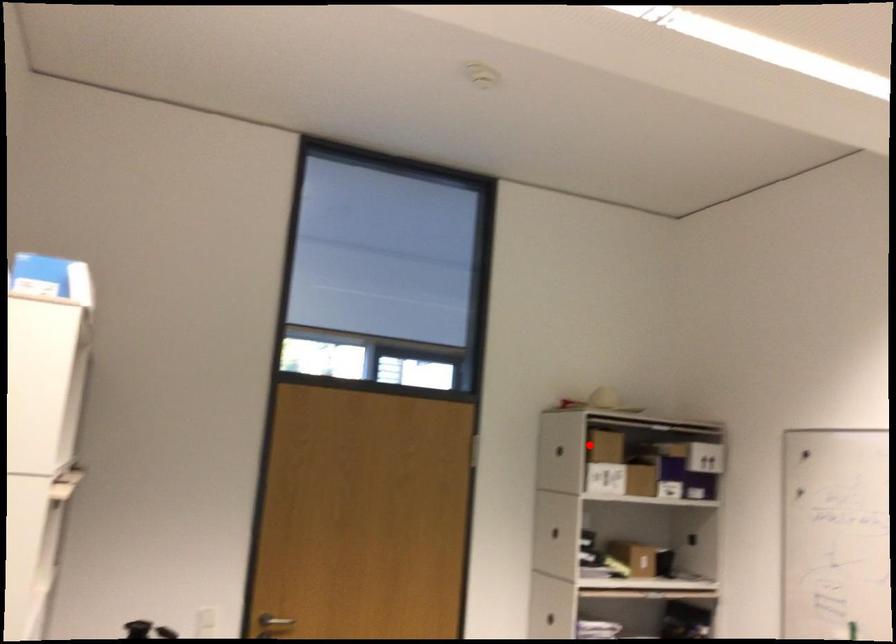
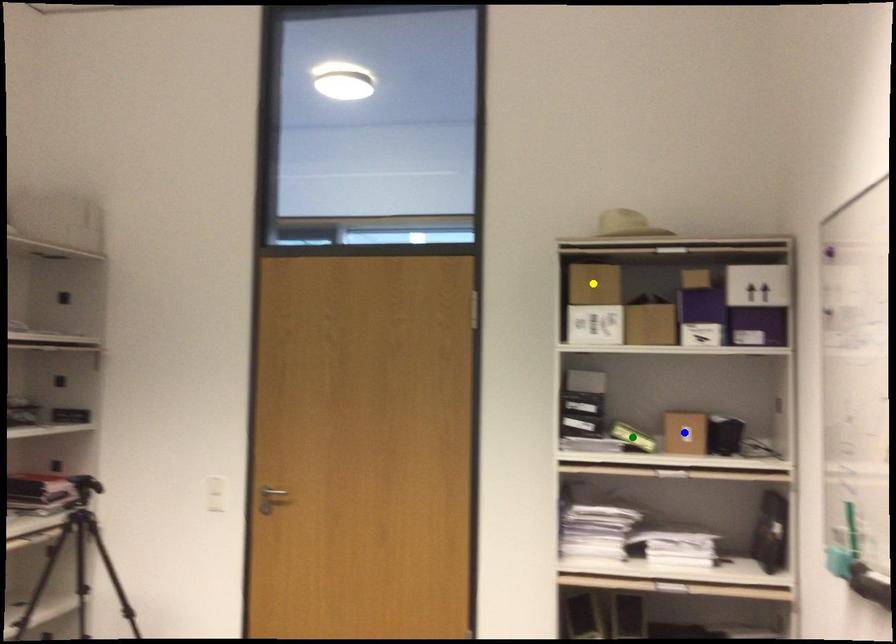
Question: I am providing you with two images of the same scene from different viewpoints. A red point is marked on the first image. You are given multiple points on the second image. In image 2, which mark is for the same physical point as the one in image 1?

Choices:
 (A) green point
 (B) yellow point
 (C) blue point

Answer: (B)